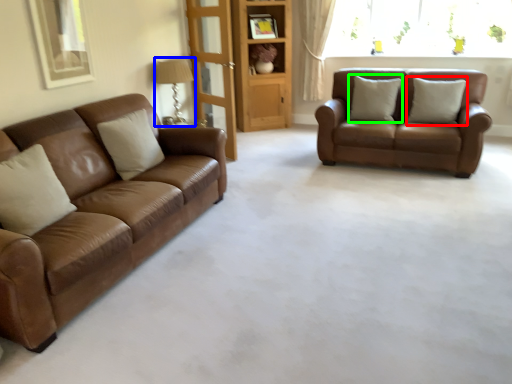
Question: Which object is positioned closest to pillow (highlighted by a red box)? Select from lamp (highlighted by a blue box) and pillow (highlighted by a green box).

Choices:
 (A) lamp
 (B) pillow

Answer: (B)